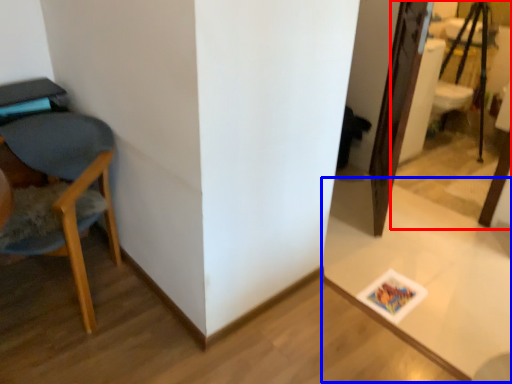
Question: Which point is closer to the camera, mirror (highlighted by a red box) or table (highlighted by a blue box)?

Choices:
 (A) mirror
 (B) table

Answer: (B)